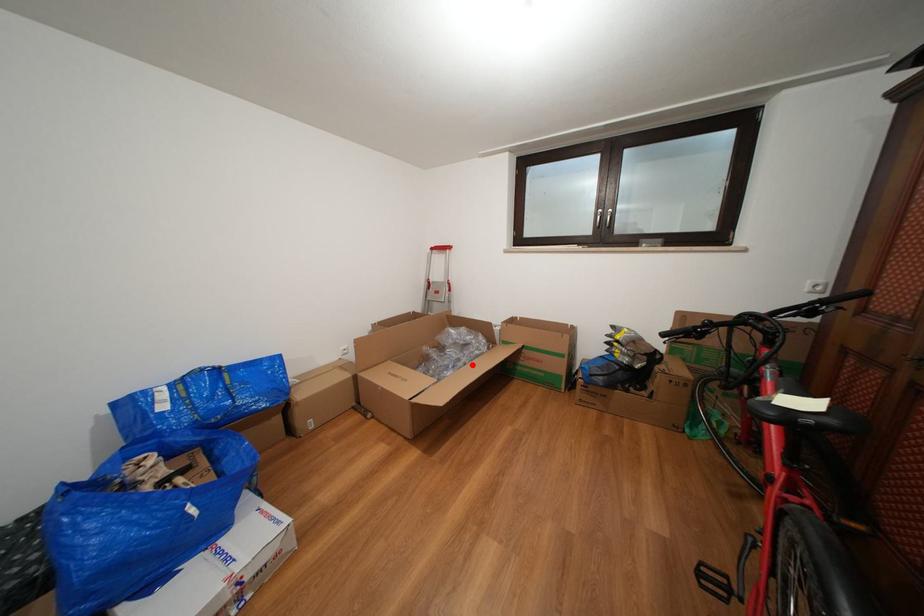
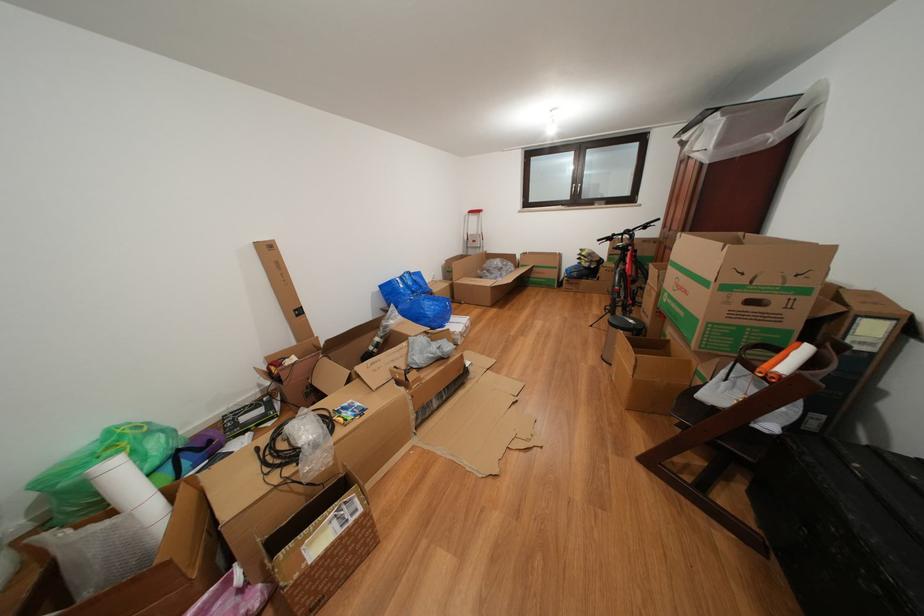
Question: A red point is marked in image1. In image2, is the corresponding 3D point closer to the camera or farther? Reply with the corresponding letter.

Choices:
 (A) The corresponding 3D point is closer.
 (B) The corresponding 3D point is farther.

Answer: (A)